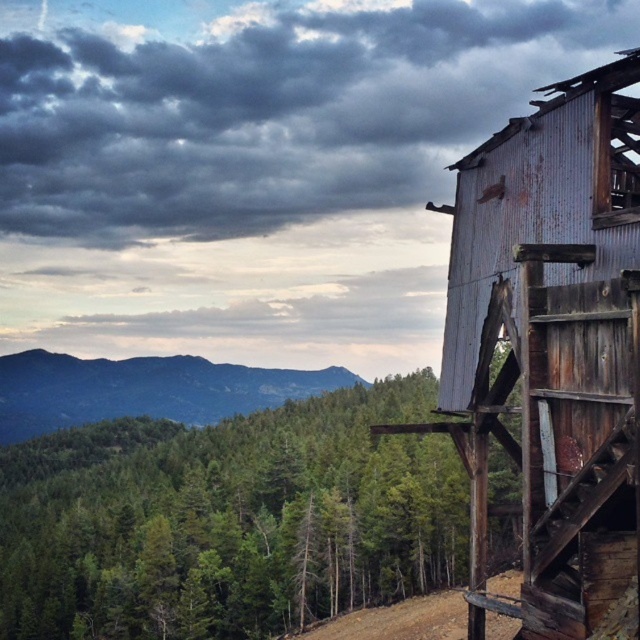
Question: Is rusty corrugated metal hut at right to the right of brown dirt track at lower center from the viewer's perspective?

Choices:
 (A) yes
 (B) no

Answer: (A)

Question: Which point is closer to the camera?

Choices:
 (A) (321, 636)
 (B) (467, 372)

Answer: (B)

Question: Can you confirm if rusty corrugated metal hut at right is thinner than brown dirt track at lower center?

Choices:
 (A) no
 (B) yes

Answer: (B)

Question: Which point is farther from the camera taking this photo?

Choices:
 (A) (516, 580)
 (B) (616, 516)
 (C) (188, 582)
 (D) (58, 358)

Answer: (D)

Question: Which of these objects is positioned farthest from the green matte tree at center?

Choices:
 (A) rusty corrugated metal hut at right
 (B) brown dirt track at lower center
 (C) green forested mountain at upper left

Answer: (C)

Question: In this image, where is rusty corrugated metal hut at right located relative to green forested mountain at upper left?

Choices:
 (A) right
 (B) left

Answer: (A)